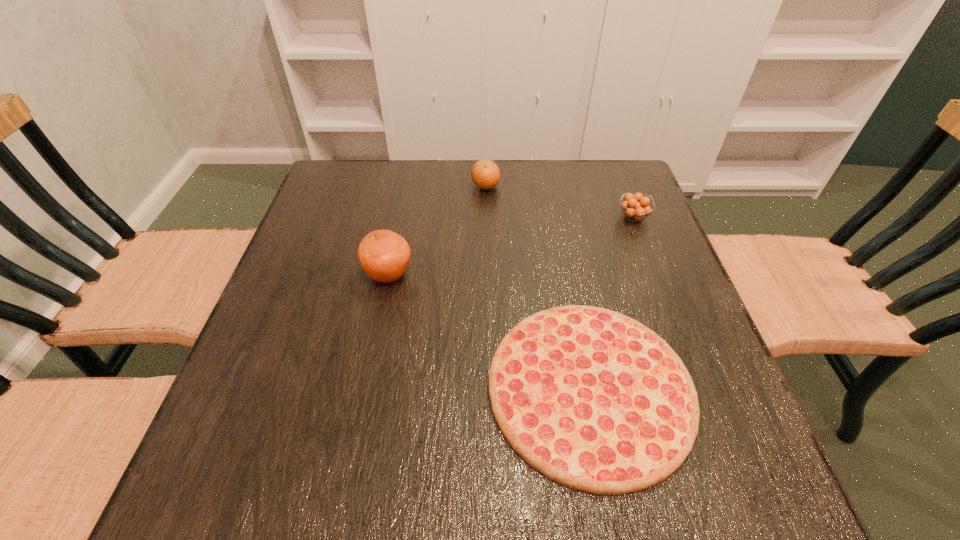
I want to click on the nearest orange fruit, so click(384, 255).

At what (x,y) coordinates should I click in order to perform the action: click on the third farthest object. Please return your answer as a coordinate pair (x, y). This screenshot has width=960, height=540. Looking at the image, I should click on (384, 255).

Locate an element on the screen. the second orange fruit from right to left is located at coordinates (485, 174).

This screenshot has height=540, width=960. What are the coordinates of `the farthest object` in the screenshot? It's located at (485, 174).

The width and height of the screenshot is (960, 540). I want to click on the second shortest object, so click(x=636, y=206).

Identify the location of the third nearest object. click(x=636, y=206).

The image size is (960, 540). Find the location of `the nearest object`. the nearest object is located at coordinates (591, 398).

The width and height of the screenshot is (960, 540). What are the coordinates of `pizza` in the screenshot? It's located at (591, 398).

This screenshot has width=960, height=540. What are the coordinates of `vacant space located 0.120m on the right of the nearest orange fruit` in the screenshot? It's located at (468, 274).

Identify the location of free point located on the back of the farthest orange fruit. (486, 165).